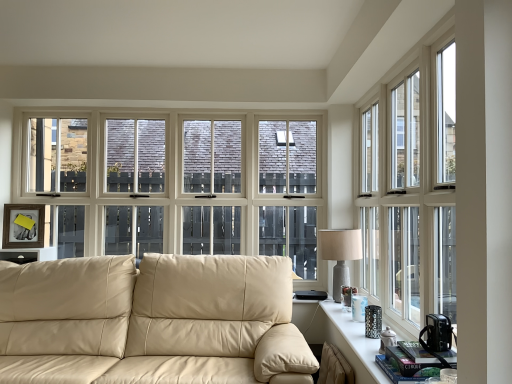
Question: Would you say matte black table at right is part of clear glass window at right's contents?

Choices:
 (A) yes
 (B) no

Answer: (B)

Question: Does clear glass window at right appear on the right side of matte black table at right?

Choices:
 (A) yes
 (B) no

Answer: (A)

Question: Does clear glass window at right have a larger size compared to matte black table at right?

Choices:
 (A) yes
 (B) no

Answer: (A)

Question: Is clear glass window at right shorter than matte black table at right?

Choices:
 (A) yes
 (B) no

Answer: (B)

Question: Can you confirm if clear glass window at right is taller than matte black table at right?

Choices:
 (A) yes
 (B) no

Answer: (A)

Question: Is the position of clear glass window at right more distant than that of matte black table at right?

Choices:
 (A) no
 (B) yes

Answer: (A)

Question: Can you confirm if beige leather couch at center is thinner than matte black side table at left?

Choices:
 (A) no
 (B) yes

Answer: (A)

Question: From the image's perspective, would you say beige leather couch at center is shown under matte black side table at left?

Choices:
 (A) no
 (B) yes

Answer: (B)

Question: From a real-world perspective, is beige leather couch at center located higher than matte black side table at left?

Choices:
 (A) no
 (B) yes

Answer: (A)

Question: Can you confirm if beige leather couch at center is bigger than matte black side table at left?

Choices:
 (A) yes
 (B) no

Answer: (A)

Question: Is there a large distance between beige leather couch at center and matte black side table at left?

Choices:
 (A) no
 (B) yes

Answer: (B)

Question: Is beige leather couch at center at the right side of matte black side table at left?

Choices:
 (A) no
 (B) yes

Answer: (B)

Question: Considering the relative sizes of beige leather couch at center and matte black table at right in the image provided, is beige leather couch at center thinner than matte black table at right?

Choices:
 (A) yes
 (B) no

Answer: (B)